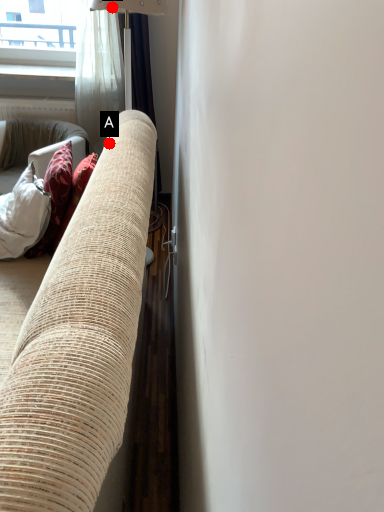
Question: Two points are circled on the image, labeled by A and B beside each circle. Which point is closer to the camera?

Choices:
 (A) A is closer
 (B) B is closer

Answer: (A)